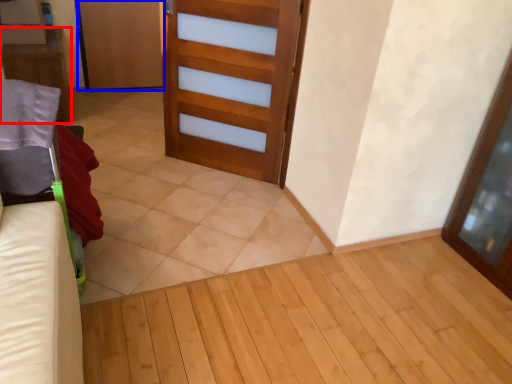
Question: Which object is closer to the camera taking this photo, furniture (highlighted by a red box) or door (highlighted by a blue box)?

Choices:
 (A) furniture
 (B) door

Answer: (A)